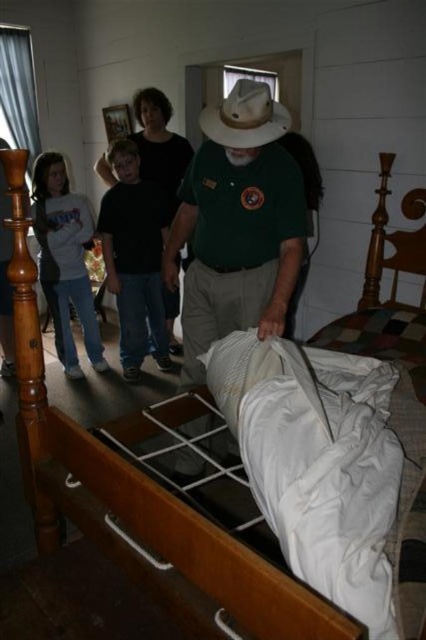
Question: Which of these objects is positioned farthest from the gray sweatshirt at left?

Choices:
 (A) green cotton shirt at center
 (B) white matte cowboy hat at center
 (C) black cotton shirt at center

Answer: (B)

Question: Does black cotton shirt at center have a smaller size compared to white matte cowboy hat at center?

Choices:
 (A) no
 (B) yes

Answer: (A)

Question: Is green cotton shirt at center to the left of gray sweatshirt at left from the viewer's perspective?

Choices:
 (A) no
 (B) yes

Answer: (A)

Question: Estimate the real-world distances between objects in this image. Which object is farther from the black cotton shirt at center?

Choices:
 (A) green cotton shirt at center
 (B) white matte cowboy hat at center

Answer: (B)

Question: Which of the following is the farthest from the observer?

Choices:
 (A) (69, 246)
 (B) (284, 112)
 (C) (290, 284)

Answer: (A)

Question: Can you confirm if green cotton shirt at center is thinner than black cotton shirt at center?

Choices:
 (A) no
 (B) yes

Answer: (A)